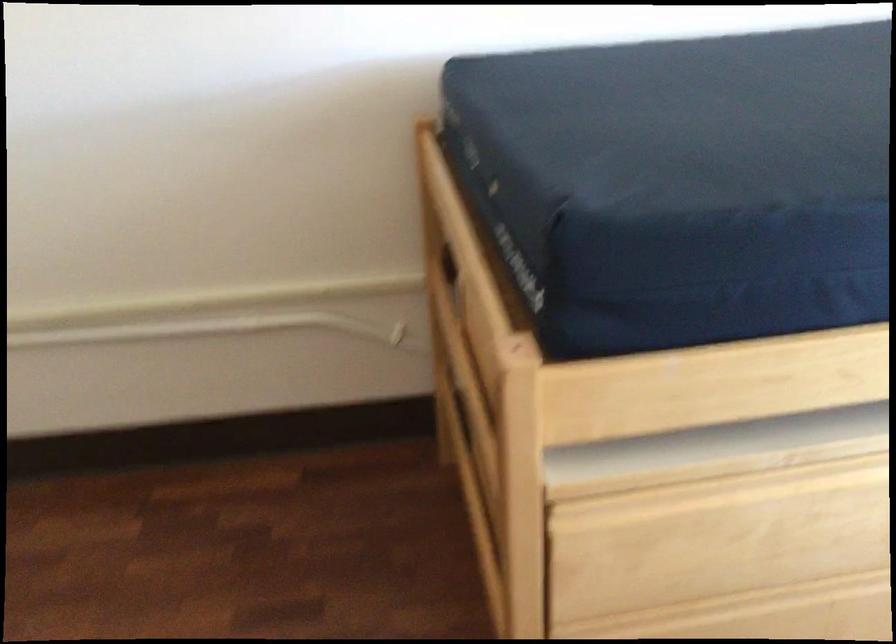
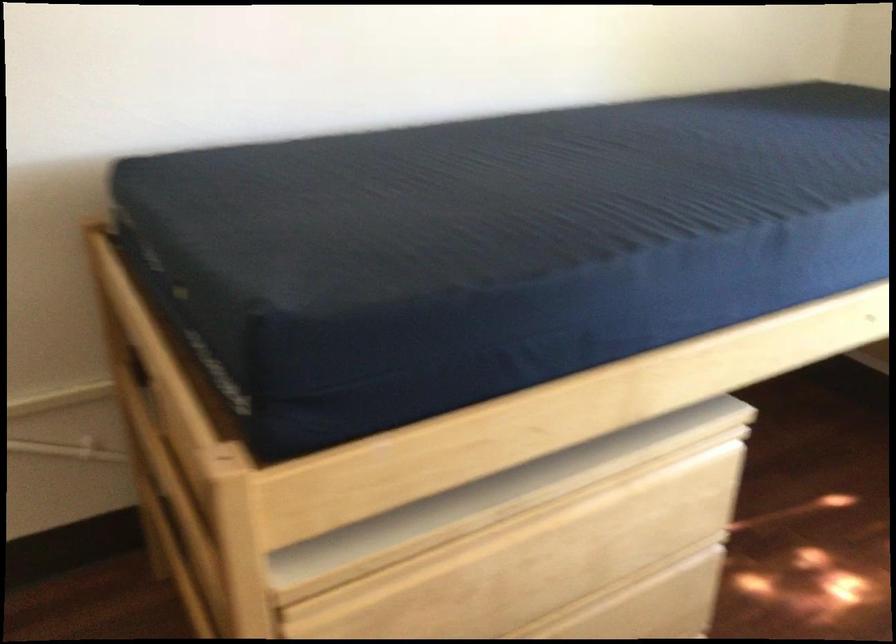
Which direction would the cameraman need to move to produce the second image?

The movement direction of the cameraman is right, backward.